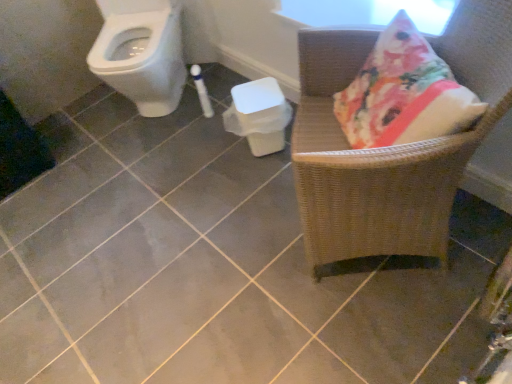
Question: In terms of size, does woven wood chair at right appear bigger or smaller than white plastic potty at center?

Choices:
 (A) small
 (B) big

Answer: (B)

Question: Relative to white plastic potty at center, is woven wood chair at right in front or behind?

Choices:
 (A) front
 (B) behind

Answer: (A)

Question: Considering the real-world distances, which object is closest to the white plastic potty at center?

Choices:
 (A) woven wood chair at right
 (B) white glossy toilet at upper left

Answer: (A)

Question: Estimate the real-world distances between objects in this image. Which object is farther from the white glossy toilet at upper left?

Choices:
 (A) woven wood chair at right
 (B) white plastic potty at center

Answer: (A)